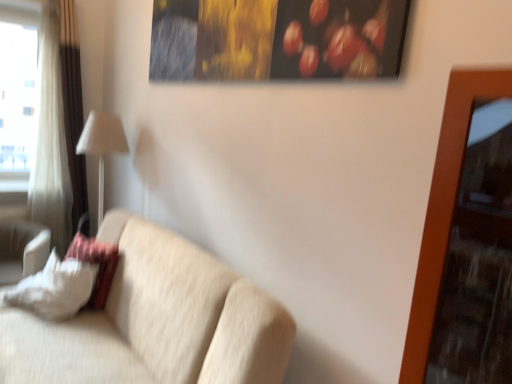
Question: Would you say white soft pillow at lower left, the 2th pillow viewed from the right, contains beige fabric couch at center?

Choices:
 (A) no
 (B) yes

Answer: (A)

Question: Considering the relative sizes of white soft pillow at lower left, the 2th pillow viewed from the right, and beige fabric couch at center in the image provided, is white soft pillow at lower left, the 2th pillow viewed from the right, taller than beige fabric couch at center?

Choices:
 (A) yes
 (B) no

Answer: (B)

Question: Is white soft pillow at lower left, which is the first pillow in left-to-right order, shorter than beige fabric couch at center?

Choices:
 (A) no
 (B) yes

Answer: (B)

Question: From the image's perspective, would you say white soft pillow at lower left, the 2th pillow viewed from the right, is positioned over beige fabric couch at center?

Choices:
 (A) yes
 (B) no

Answer: (A)

Question: Is white soft pillow at lower left, which is the first pillow in left-to-right order, outside of beige fabric couch at center?

Choices:
 (A) yes
 (B) no

Answer: (A)

Question: Is white fabric lampshade at left wider or thinner than white fabric pillow at left, the 2th pillow in the left-to-right sequence?

Choices:
 (A) wide
 (B) thin

Answer: (A)

Question: From the image's perspective, is white fabric lampshade at left positioned above or below white fabric pillow at left, the 1th pillow from the right?

Choices:
 (A) below
 (B) above

Answer: (B)

Question: From a real-world perspective, is white fabric lampshade at left physically located above or below white fabric pillow at left, the 2th pillow in the left-to-right sequence?

Choices:
 (A) below
 (B) above

Answer: (B)

Question: In the image, is white fabric lampshade at left positioned in front of or behind white fabric pillow at left, the 1th pillow from the right?

Choices:
 (A) front
 (B) behind

Answer: (B)

Question: Is white fabric lampshade at left taller or shorter than white fabric curtain at left?

Choices:
 (A) tall
 (B) short

Answer: (B)

Question: Relative to white fabric curtain at left, is white fabric lampshade at left in front or behind?

Choices:
 (A) front
 (B) behind

Answer: (A)

Question: Is white fabric lampshade at left situated inside white fabric curtain at left or outside?

Choices:
 (A) outside
 (B) inside

Answer: (A)

Question: Considering the relative positions of white fabric lampshade at left and white fabric curtain at left in the image provided, is white fabric lampshade at left to the left or to the right of white fabric curtain at left?

Choices:
 (A) right
 (B) left

Answer: (A)

Question: Based on their positions, is white fabric curtain at left located to the left or right of beige fabric couch at center?

Choices:
 (A) right
 (B) left

Answer: (B)

Question: From their relative heights in the image, would you say white fabric curtain at left is taller or shorter than beige fabric couch at center?

Choices:
 (A) short
 (B) tall

Answer: (B)